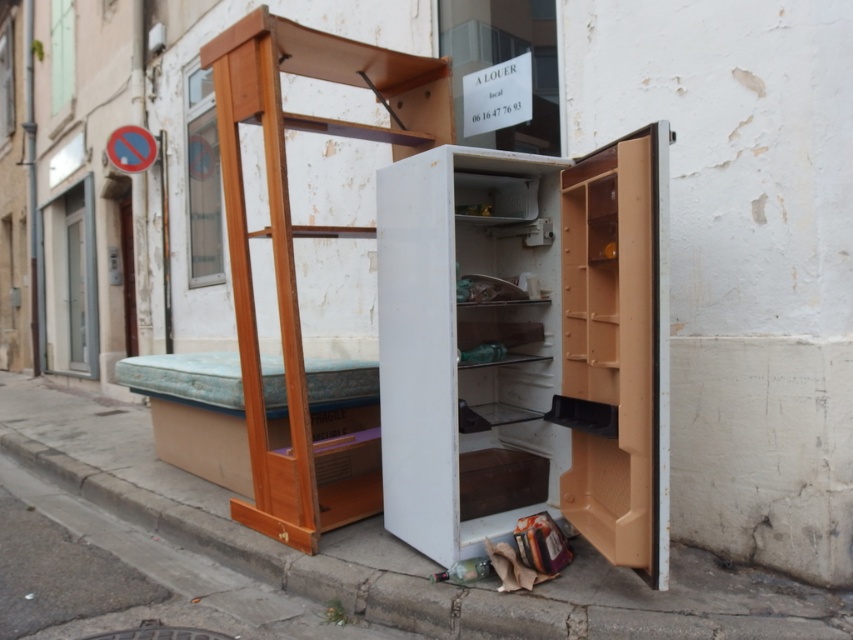
Question: Is the position of white concrete pavement at lower center less distant than that of wooden ladder at left?

Choices:
 (A) yes
 (B) no

Answer: (A)

Question: Is white plastic refrigerator at center further to the viewer compared to wooden ladder at left?

Choices:
 (A) no
 (B) yes

Answer: (A)

Question: Which point is farther to the camera?

Choices:
 (A) (376, 195)
 (B) (47, 396)

Answer: (B)

Question: Where is white plastic refrigerator at center located in relation to wooden ladder at left in the image?

Choices:
 (A) above
 (B) below

Answer: (B)

Question: Considering the real-world distances, which object is farthest from the white concrete pavement at lower center?

Choices:
 (A) wooden ladder at left
 (B) white plastic refrigerator at center

Answer: (A)

Question: Among these points, which one is nearest to the camera?

Choices:
 (A) (560, 275)
 (B) (512, 605)
 (C) (318, 45)

Answer: (B)